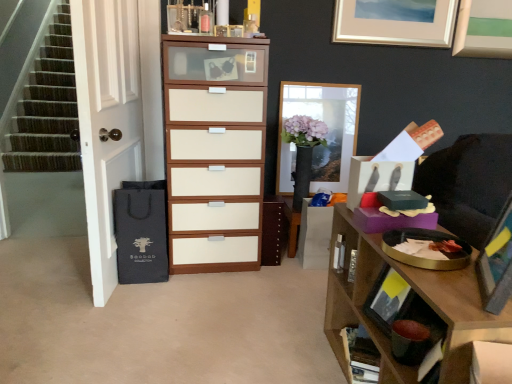
Find the location of a particular element. vacant position to the left of wooden picture frame at right, which is counted as the third picture frame, starting from the top is located at coordinates (453, 295).